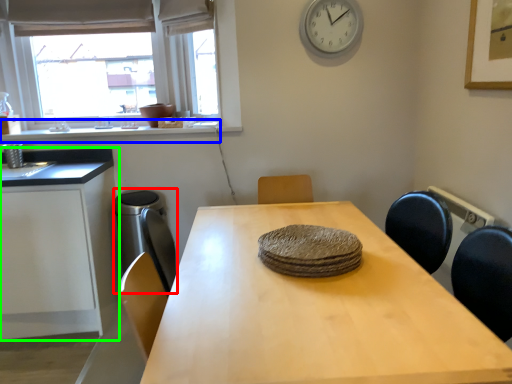
Question: Based on their relative distances, which object is farther from appliance (highlighted by a red box)? Choose from window sill (highlighted by a blue box) and cabinetry (highlighted by a green box).

Choices:
 (A) window sill
 (B) cabinetry

Answer: (A)